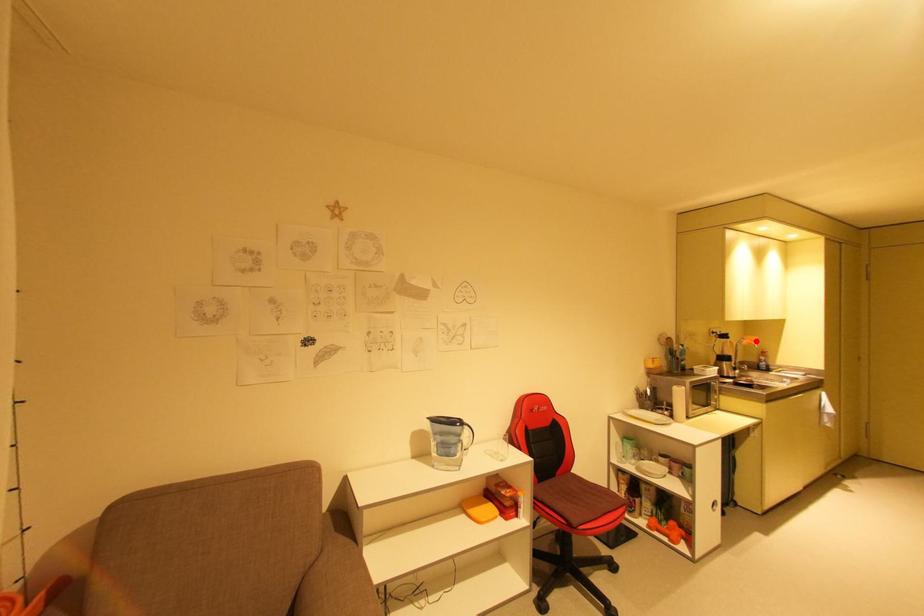
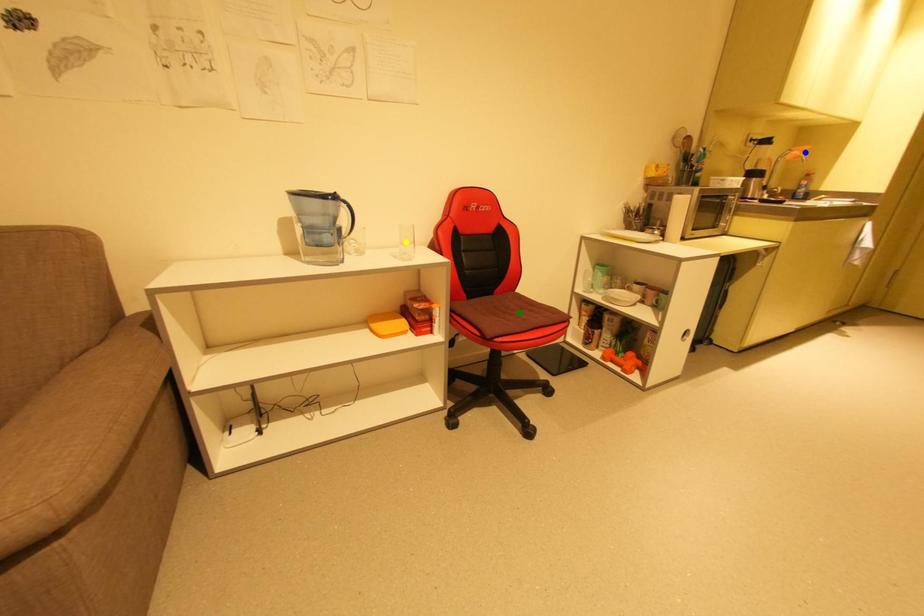
Question: I am providing you with two images of the same scene from different viewpoints. A red point is marked on the first image. You are given multiple points on the second image. Which point in image 2 represents the same 3d spot as the red point in image 1?

Choices:
 (A) green point
 (B) yellow point
 (C) blue point

Answer: (C)